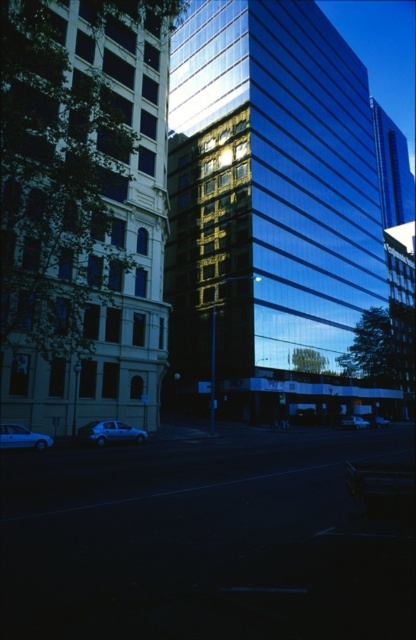
Consider the image. You are a delivery person standing at the point marked by the coordinates point [393,170]. You need to deliver a package to the glossy glass building at upper right. Is your current position the correct location for the delivery?

The point [393,170] corresponds to the glossy glass building at upper right, so yes, your current position is correct for the delivery.

You are a city planner assessing the urban layout. Considering the smooth glass building at center and the silver metallic car at lower left, which object occupies a larger vertical space in the scene?

The smooth glass building at center has a greater height compared to the silver metallic car at lower left, so it occupies a larger vertical space in the scene.

You are a delivery person with a cart that is 12 feet wide. You need to move between the silver metallic car at lower left and the white glossy car at lower left. Can your cart fit through the space between them?

The silver metallic car at lower left and white glossy car at lower left are 11.84 feet apart. Since your cart is 12 feet wide, it cannot fit through the space between them as the gap is slightly narrower than the cart.